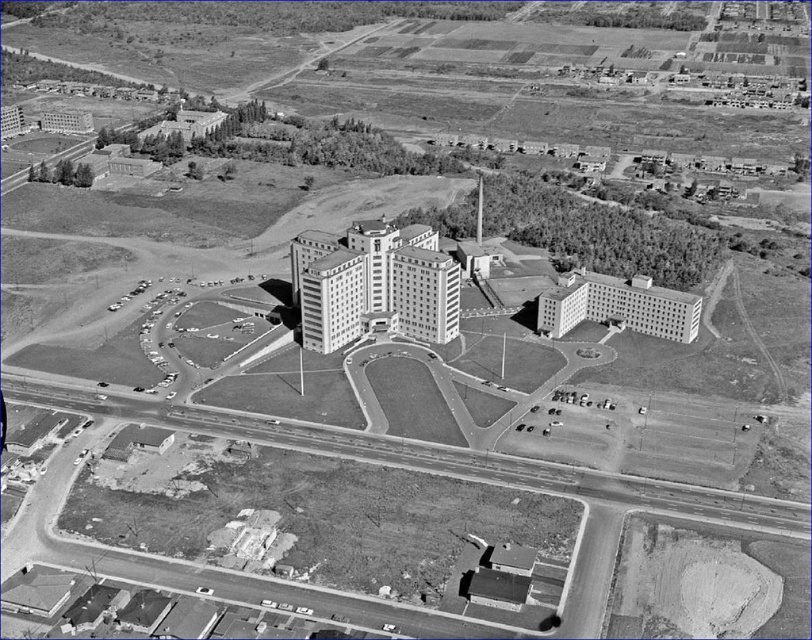
Who is more forward, (x=421, y=292) or (x=633, y=316)?

Positioned in front is point (x=421, y=292).

Can you confirm if smooth concrete building at center is positioned below smooth concrete building at center-right?

Incorrect, smooth concrete building at center is not positioned below smooth concrete building at center-right.

Who is more forward, (342,332) or (556,284)?

Positioned in front is point (342,332).

At what (x,y) coordinates should I click in order to perform the action: click on smooth concrete building at center. Please return your answer as a coordinate pair (x, y). This screenshot has width=812, height=640. Looking at the image, I should click on (374, 284).